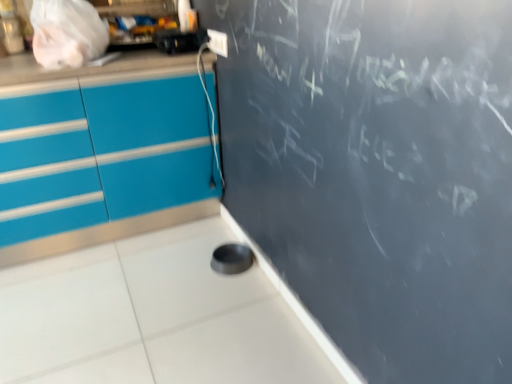
Question: From the image's perspective, is black plastic toaster at upper left beneath white plastic electric outlet at upper center?

Choices:
 (A) no
 (B) yes

Answer: (A)

Question: Is black plastic toaster at upper left to the right of white plastic electric outlet at upper center from the viewer's perspective?

Choices:
 (A) no
 (B) yes

Answer: (A)

Question: Could you tell me if black plastic toaster at upper left is turned towards white plastic electric outlet at upper center?

Choices:
 (A) yes
 (B) no

Answer: (B)

Question: Considering the relative positions of black plastic toaster at upper left and white plastic electric outlet at upper center in the image provided, is black plastic toaster at upper left in front of white plastic electric outlet at upper center?

Choices:
 (A) yes
 (B) no

Answer: (A)

Question: Is black plastic toaster at upper left bigger than white plastic electric outlet at upper center?

Choices:
 (A) no
 (B) yes

Answer: (B)

Question: Is black plastic toaster at upper left far from white plastic electric outlet at upper center?

Choices:
 (A) no
 (B) yes

Answer: (A)

Question: Is white plastic electric outlet at upper center next to black plastic toaster at upper left?

Choices:
 (A) no
 (B) yes

Answer: (A)

Question: Is the position of white plastic electric outlet at upper center more distant than that of black plastic toaster at upper left?

Choices:
 (A) yes
 (B) no

Answer: (A)

Question: Does white plastic electric outlet at upper center contain black plastic toaster at upper left?

Choices:
 (A) no
 (B) yes

Answer: (A)

Question: Is white plastic electric outlet at upper center not within black plastic toaster at upper left?

Choices:
 (A) no
 (B) yes

Answer: (B)

Question: Is white plastic electric outlet at upper center in front of black plastic toaster at upper left?

Choices:
 (A) no
 (B) yes

Answer: (A)

Question: Is white plastic electric outlet at upper center facing away from black plastic toaster at upper left?

Choices:
 (A) yes
 (B) no

Answer: (B)

Question: Looking at their shapes, would you say white plastic electric outlet at upper center is wider or thinner than black plastic toaster at upper left?

Choices:
 (A) thin
 (B) wide

Answer: (A)